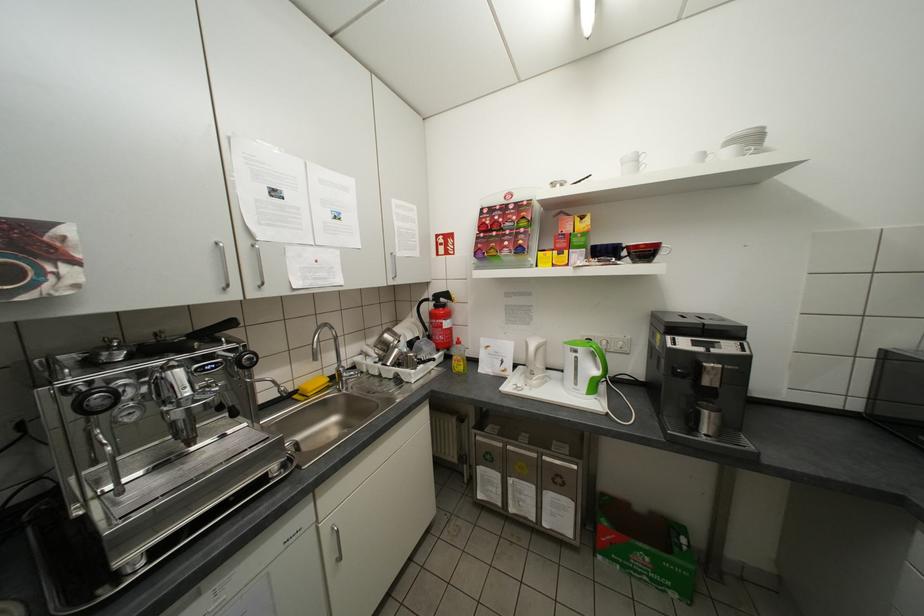
Where would you lift the yellow dish soap? Please return your answer as a coordinate pair (x, y).

(312, 387)